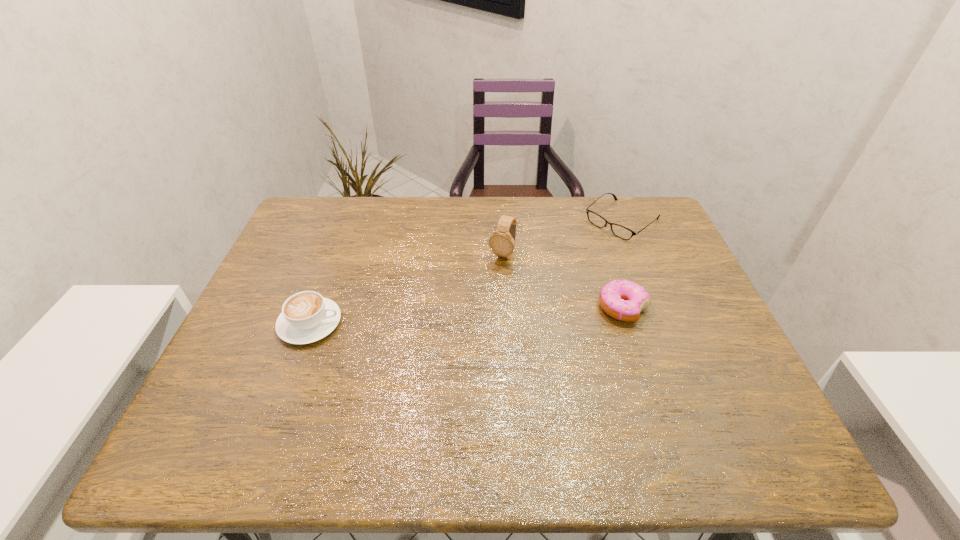
Where is `cappuccino`? The image size is (960, 540). cappuccino is located at coordinates (306, 317).

You are a GUI agent. You are given a task and a screenshot of the screen. Output one action in this format:
    pyautogui.click(x=<x>, y=<y>)
    Task: Click on the third shortest object
    The width and height of the screenshot is (960, 540).
    Given the screenshot: What is the action you would take?
    pyautogui.click(x=306, y=317)

Locate an element on the screen. This screenshot has height=540, width=960. doughnut is located at coordinates (623, 300).

What are the coordinates of `the shortest object` in the screenshot? It's located at (620, 231).

I want to click on watch, so click(x=502, y=242).

Locate an element on the screen. This screenshot has width=960, height=540. the tallest object is located at coordinates (502, 242).

Locate an element on the screen. The width and height of the screenshot is (960, 540). free space located on the side of the leftmost object with the handle is located at coordinates tap(451, 323).

Identify the location of free point located 0.060m on the left of the doughnut. click(x=574, y=308).

You are a GUI agent. You are given a task and a screenshot of the screen. Output one action in this format:
    pyautogui.click(x=<x>, y=<y>)
    Task: Click on the free space located on the front-facing side of the shortest object
    This screenshot has width=960, height=540.
    Given the screenshot: What is the action you would take?
    pyautogui.click(x=587, y=248)

Image resolution: width=960 pixels, height=540 pixels. I want to click on blank space located on the front-facing side of the shortest object, so click(577, 256).